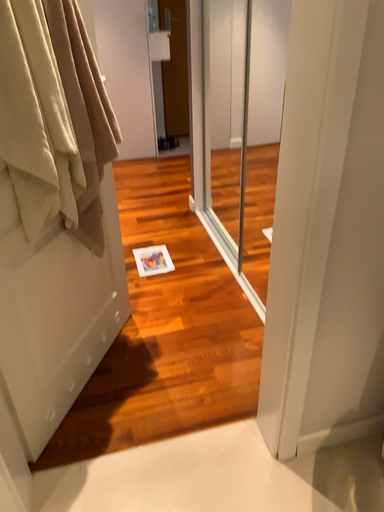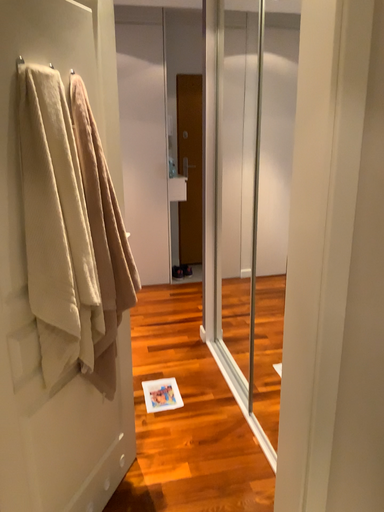
Question: Which way did the camera rotate in the video?

Choices:
 (A) rotated upward
 (B) rotated downward

Answer: (A)